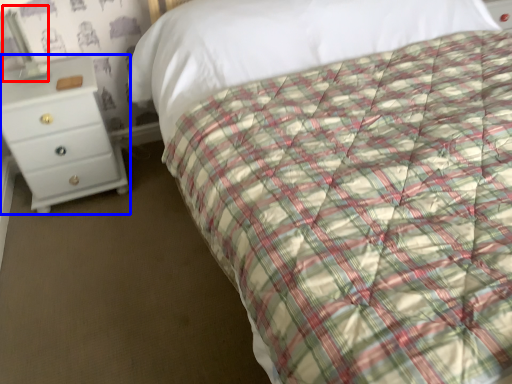
Question: Which point is further to the camera, bedside lamp (highlighted by a red box) or chest of drawers (highlighted by a blue box)?

Choices:
 (A) bedside lamp
 (B) chest of drawers

Answer: (B)